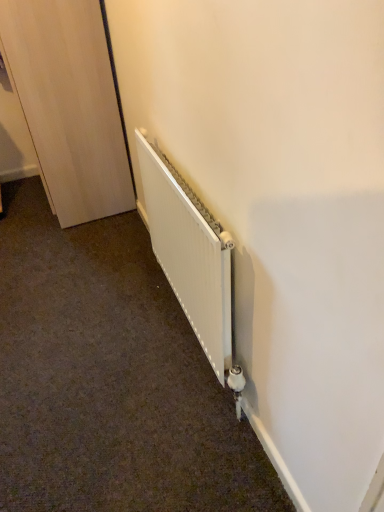
Locate an element on the screen. The width and height of the screenshot is (384, 512). light wood door at left is located at coordinates [69, 105].

Measure the distance between point [84,38] and camera.

Point [84,38] and camera are 1.89 meters apart.

What do you see at coordinates (69, 105) in the screenshot? I see `light wood door at left` at bounding box center [69, 105].

What is the approximate height of white matte radiator at lower center?

The height of white matte radiator at lower center is 28.09 inches.

Measure the distance between white matte radiator at lower center and camera.

white matte radiator at lower center is 3.43 feet away from camera.

What do you see at coordinates (189, 253) in the screenshot? This screenshot has height=512, width=384. I see `white matte radiator at lower center` at bounding box center [189, 253].

This screenshot has height=512, width=384. I want to click on white matte radiator at lower center, so click(189, 253).

Find the location of a particular element. The height and width of the screenshot is (512, 384). light wood door at left is located at coordinates click(69, 105).

Consider the image. Which object is positioned more to the left, white matte radiator at lower center or light wood door at left?

light wood door at left is more to the left.

Between white matte radiator at lower center and light wood door at left, which one is positioned in front?

white matte radiator at lower center.

Which is behind, point (141, 170) or point (84, 217)?

Positioned behind is point (84, 217).

From the image's perspective, which object appears higher, white matte radiator at lower center or light wood door at left?

light wood door at left, from the image's perspective.

From a real-world perspective, is white matte radiator at lower center below light wood door at left?

Yes, from a real-world perspective, white matte radiator at lower center is beneath light wood door at left.

Is white matte radiator at lower center wider than light wood door at left?

No, white matte radiator at lower center is not wider than light wood door at left.

Can you confirm if white matte radiator at lower center is shorter than light wood door at left?

Yes.

Is white matte radiator at lower center bigger or smaller than light wood door at left?

white matte radiator at lower center is smaller than light wood door at left.

Does white matte radiator at lower center contain light wood door at left?

No, white matte radiator at lower center does not contain light wood door at left.

Consider the image. Would you consider white matte radiator at lower center to be distant from light wood door at left?

They are positioned close to each other.

Is white matte radiator at lower center facing towards light wood door at left?

No, white matte radiator at lower center is not turned towards light wood door at left.

How much distance is there between white matte radiator at lower center and light wood door at left?

A distance of 85.58 centimeters exists between white matte radiator at lower center and light wood door at left.

Image resolution: width=384 pixels, height=512 pixels. In order to click on radiator on the right of light wood door at left in this screenshot , I will do `click(189, 253)`.

Which is more to the left, light wood door at left or white matte radiator at lower center?

Positioned to the left is light wood door at left.

Is light wood door at left positioned in front of white matte radiator at lower center?

No, the depth of light wood door at left is greater than that of white matte radiator at lower center.

Is point (50, 52) more distant than point (231, 346)?

Yes, point (50, 52) is farther from viewer.

From the picture: From the image's perspective, which is below, light wood door at left or white matte radiator at lower center?

white matte radiator at lower center.

From a real-world perspective, who is located higher, light wood door at left or white matte radiator at lower center?

From a 3D spatial view, light wood door at left is above.

Based on the photo, considering the relative sizes of light wood door at left and white matte radiator at lower center in the image provided, is light wood door at left wider than white matte radiator at lower center?

Indeed, light wood door at left has a greater width compared to white matte radiator at lower center.

Considering the sizes of objects light wood door at left and white matte radiator at lower center in the image provided, who is shorter, light wood door at left or white matte radiator at lower center?

With less height is white matte radiator at lower center.

Considering the sizes of objects light wood door at left and white matte radiator at lower center in the image provided, who is bigger, light wood door at left or white matte radiator at lower center?

Bigger between the two is light wood door at left.

Is white matte radiator at lower center surrounded by light wood door at left?

Actually, white matte radiator at lower center is outside light wood door at left.

Is light wood door at left touching white matte radiator at lower center?

There is a gap between light wood door at left and white matte radiator at lower center.

Could you tell me if light wood door at left is turned towards white matte radiator at lower center?

No.

What's the angular difference between light wood door at left and white matte radiator at lower center's facing directions?

They differ by 1.79 degrees in their facing directions.

How distant is light wood door at left from white matte radiator at lower center?

light wood door at left is 33.69 inches from white matte radiator at lower center.

Locate an element on the screen. This screenshot has height=512, width=384. radiator below the light wood door at left (from the image's perspective) is located at coordinates (189, 253).

I want to click on radiator lying on the right of light wood door at left, so click(x=189, y=253).

Locate an element on the screen. This screenshot has height=512, width=384. radiator below the light wood door at left (from the image's perspective) is located at coordinates (189, 253).